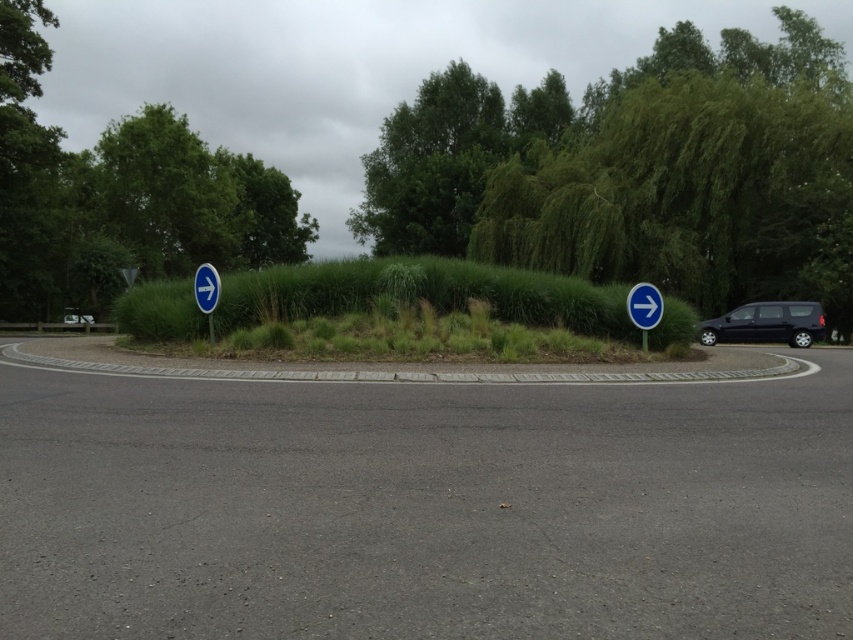
Can you confirm if green grassy hedge at center is wider than blue plastic signpost at left?

Indeed, green grassy hedge at center has a greater width compared to blue plastic signpost at left.

Can you confirm if green grassy hedge at center is positioned below blue plastic signpost at left?

Incorrect, green grassy hedge at center is not positioned below blue plastic signpost at left.

This screenshot has height=640, width=853. Find the location of `green grassy hedge at center`. green grassy hedge at center is located at coordinates (421, 292).

Does green leafy tree at upper left lie in front of black matte van at right?

No.

Between green leafy tree at upper left and black matte van at right, which one is positioned lower?

black matte van at right is lower down.

Between point (102, 141) and point (804, 314), which one is positioned behind?

Point (102, 141)

The height and width of the screenshot is (640, 853). Identify the location of green leafy tree at upper left. (120, 195).

Which is above, green leafy tree at upper left or blue plastic sign at left?

Positioned higher is green leafy tree at upper left.

Between point (13, 172) and point (215, 284), which one is positioned in front?

Point (215, 284)

Where is `green leafy tree at upper left`? green leafy tree at upper left is located at coordinates (120, 195).